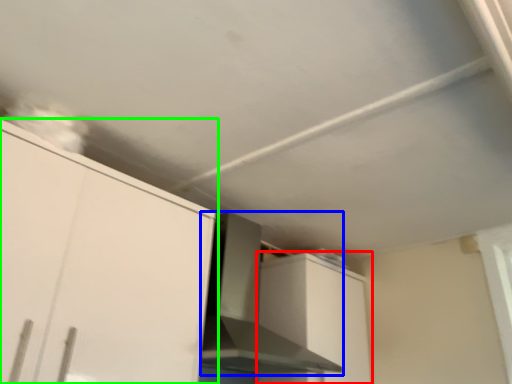
Question: Estimate the real-world distances between objects in this image. Which object is closer to cabinetry (highlighted by a red box), vent (highlighted by a blue box) or cabinetry (highlighted by a green box)?

Choices:
 (A) vent
 (B) cabinetry

Answer: (A)